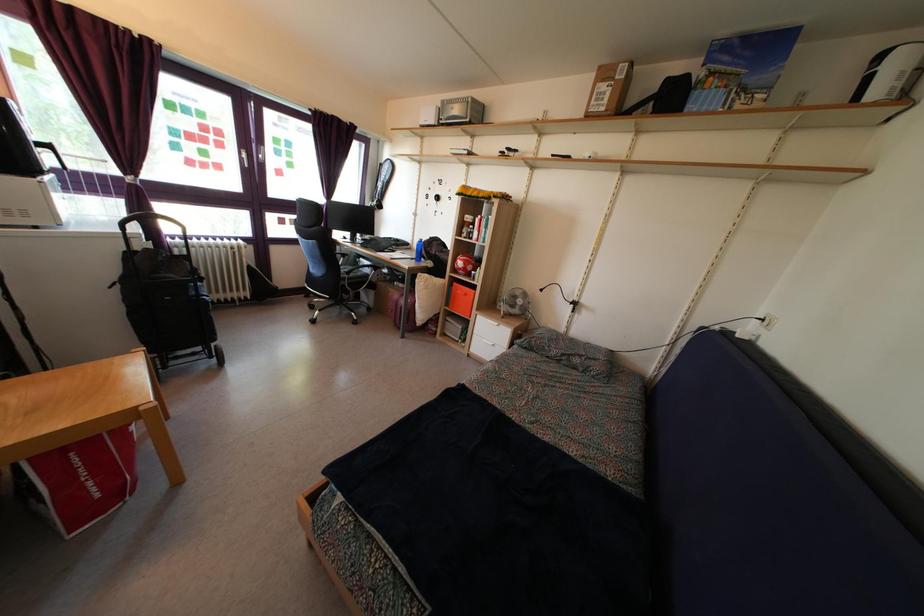
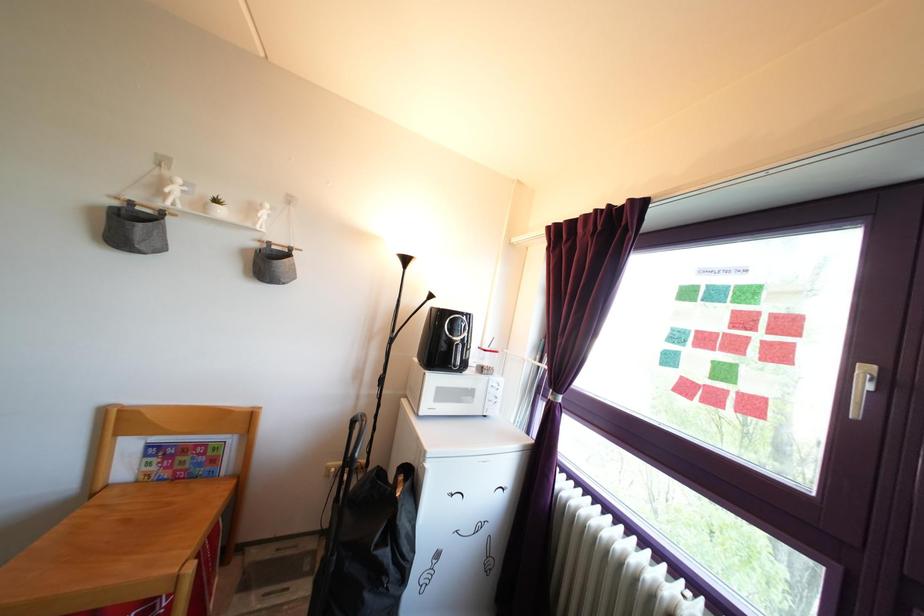
The point at (207, 175) is marked in the first image. Where is the corresponding point in the second image?

(715, 407)